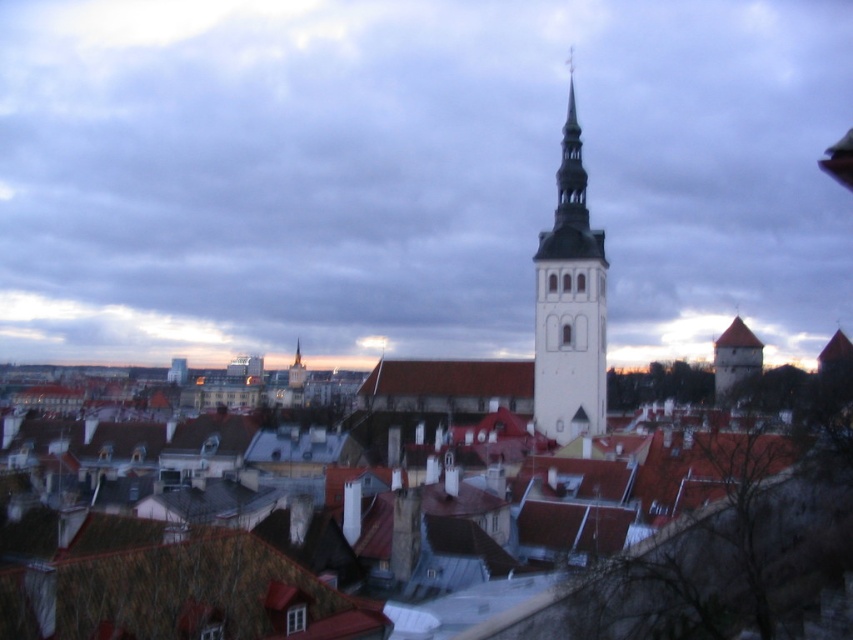
Question: Which of the following is the farthest from the observer?

Choices:
 (A) matte white tower at center
 (B) brown tile roof at center
 (C) white stone bell tower at center
 (D) brown stone tower at right

Answer: (D)

Question: Can you confirm if brown tile roofs at center is positioned below brown stone tower at right?

Choices:
 (A) yes
 (B) no

Answer: (A)

Question: Does brown tile roofs at center have a larger size compared to brown tile roof at center?

Choices:
 (A) yes
 (B) no

Answer: (A)

Question: Which point is closer to the camera?

Choices:
 (A) brown stone tower at right
 (B) brown tile roof at center
 (C) brown tile roofs at center

Answer: (C)

Question: Which is farther from the white stone bell tower at center?

Choices:
 (A) brown tile roof at center
 (B) matte white tower at center
 (C) brown stone tower at right

Answer: (C)

Question: Is white stone bell tower at center closer to camera compared to brown stone tower at right?

Choices:
 (A) yes
 (B) no

Answer: (A)